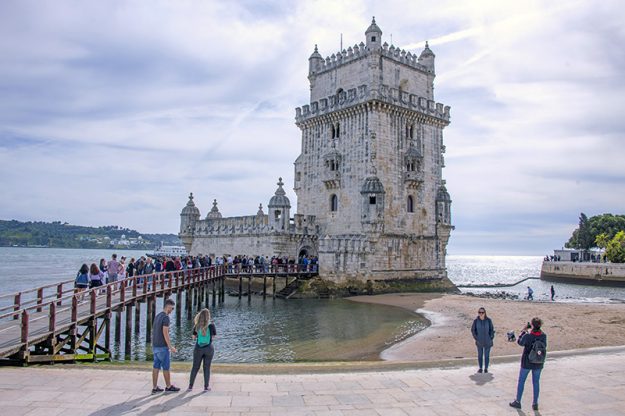
This screenshot has width=625, height=416. What are the coordinates of `door` in the screenshot? It's located at (309, 254).